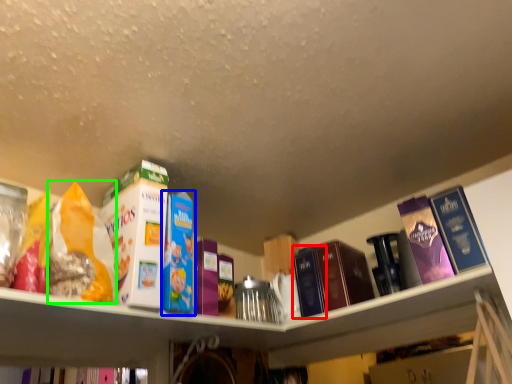
Question: Based on their relative distances, which object is farther from book (highlighted by a red box)? Choose from book (highlighted by a blue box) and cereal (highlighted by a green box).

Choices:
 (A) book
 (B) cereal

Answer: (B)